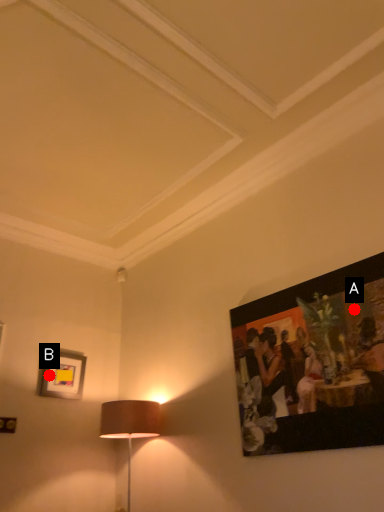
Question: Two points are circled on the image, labeled by A and B beside each circle. Which point is further to the camera?

Choices:
 (A) A is further
 (B) B is further

Answer: (B)